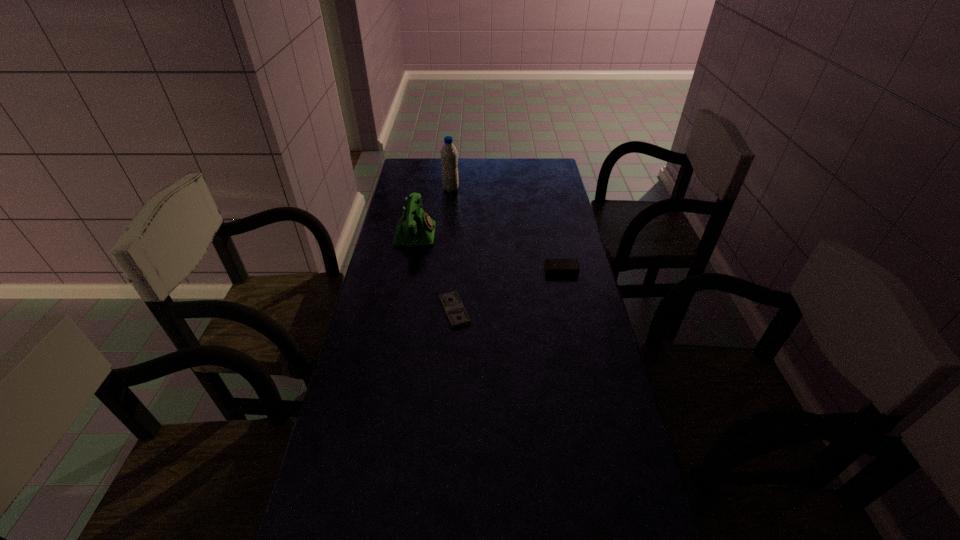
Locate an element on the screen. The image size is (960, 540). free point between the telephone and the alarm clock is located at coordinates (489, 252).

Find the location of `free area in between the water bottle and the third farthest object`. free area in between the water bottle and the third farthest object is located at coordinates (506, 230).

You are a GUI agent. You are given a task and a screenshot of the screen. Output one action in this format:
    pyautogui.click(x=<x>, y=<y>)
    Task: Click on the free space between the nearest object and the tallest object
    The width and height of the screenshot is (960, 540).
    Given the screenshot: What is the action you would take?
    pyautogui.click(x=453, y=250)

The height and width of the screenshot is (540, 960). In order to click on free space between the third farthest object and the leftmost object in this screenshot , I will do `click(489, 252)`.

Where is `free area in between the farthest object and the telephone`? Image resolution: width=960 pixels, height=540 pixels. free area in between the farthest object and the telephone is located at coordinates [433, 212].

Locate an element on the screen. free space that is in between the water bottle and the second nearest object is located at coordinates (506, 230).

The height and width of the screenshot is (540, 960). Find the location of `free area in between the dollar and the alarm clock`. free area in between the dollar and the alarm clock is located at coordinates (508, 291).

Identify which object is located as the second nearest to the water bottle. Please provide its 2D coordinates. Your answer should be formatted as a tuple, i.e. [(x, y)], where the tuple contains the x and y coordinates of a point satisfying the conditions above.

[(553, 266)]

Where is `object that is the closest one to the shortest object`? object that is the closest one to the shortest object is located at coordinates (415, 228).

The width and height of the screenshot is (960, 540). Find the location of `free location that satisfies the following two spatial constraints: 1. on the front side of the tallest object; 2. on the dial of the leftmost object`. free location that satisfies the following two spatial constraints: 1. on the front side of the tallest object; 2. on the dial of the leftmost object is located at coordinates (446, 234).